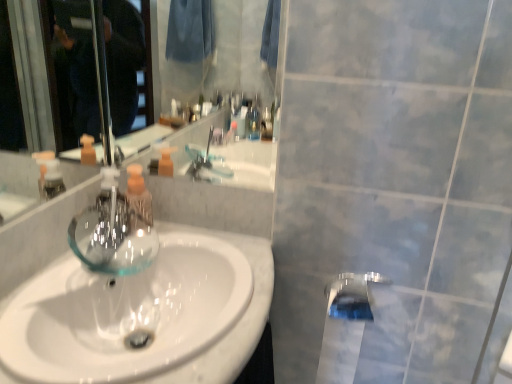
Question: Is chrome metallic tap at lower center to the left of clear glass bottle at center from the viewer's perspective?

Choices:
 (A) yes
 (B) no

Answer: (B)

Question: Would you consider chrome metallic tap at lower center to be distant from clear glass bottle at center?

Choices:
 (A) yes
 (B) no

Answer: (B)

Question: Can we say chrome metallic tap at lower center lies outside clear glass bottle at center?

Choices:
 (A) yes
 (B) no

Answer: (A)

Question: From a real-world perspective, is chrome metallic tap at lower center on top of clear glass bottle at center?

Choices:
 (A) yes
 (B) no

Answer: (B)

Question: Is the surface of chrome metallic tap at lower center in direct contact with clear glass bottle at center?

Choices:
 (A) yes
 (B) no

Answer: (B)

Question: Is chrome metallic tap at lower center taller or shorter than clear glass faucet at center?

Choices:
 (A) short
 (B) tall

Answer: (A)

Question: Looking at their shapes, would you say chrome metallic tap at lower center is wider or thinner than clear glass faucet at center?

Choices:
 (A) wide
 (B) thin

Answer: (B)

Question: Is chrome metallic tap at lower center to the left or to the right of clear glass faucet at center in the image?

Choices:
 (A) left
 (B) right

Answer: (B)

Question: Considering the positions of chrome metallic tap at lower center and clear glass faucet at center in the image, is chrome metallic tap at lower center bigger or smaller than clear glass faucet at center?

Choices:
 (A) big
 (B) small

Answer: (A)

Question: Is point (136, 193) closer or farther from the camera than point (367, 311)?

Choices:
 (A) farther
 (B) closer

Answer: (A)

Question: Considering the positions of clear glass bottle at center and chrome metallic tap at lower center in the image, is clear glass bottle at center wider or thinner than chrome metallic tap at lower center?

Choices:
 (A) thin
 (B) wide

Answer: (A)

Question: From the image's perspective, relative to chrome metallic tap at lower center, is clear glass bottle at center above or below?

Choices:
 (A) below
 (B) above

Answer: (B)

Question: Considering the positions of clear glass bottle at center and chrome metallic tap at lower center in the image, is clear glass bottle at center bigger or smaller than chrome metallic tap at lower center?

Choices:
 (A) big
 (B) small

Answer: (B)

Question: Based on their sizes in the image, would you say clear glass faucet at center is bigger or smaller than white glossy sink at center?

Choices:
 (A) big
 (B) small

Answer: (B)

Question: From the image's perspective, is clear glass faucet at center above or below white glossy sink at center?

Choices:
 (A) below
 (B) above

Answer: (B)